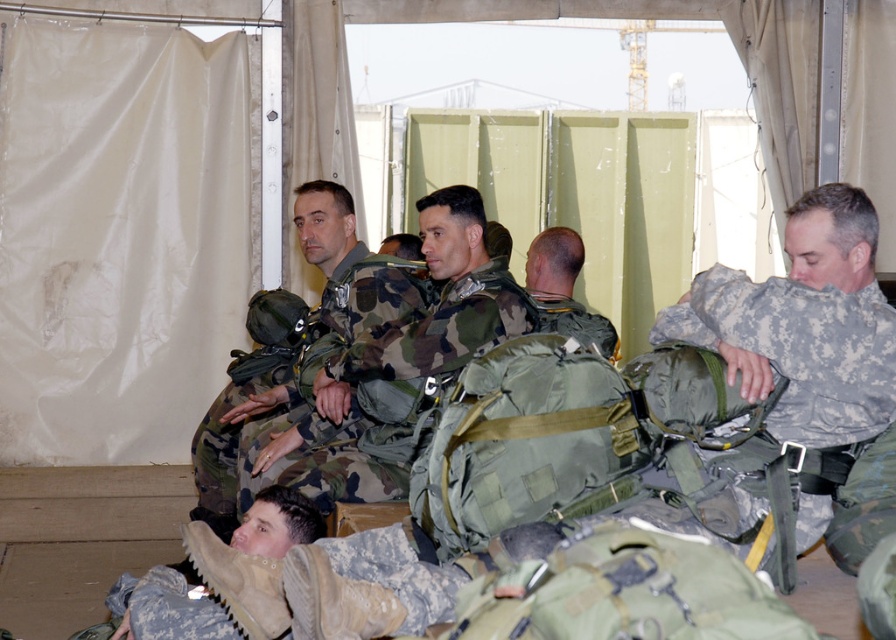
You are a photographer positioned outside the tent and want to capture a photo of both the camouflage fabric uniform at center and the green camouflage backpack at center. To ensure both are visible in the frame, should you adjust your camera to focus more to the left or the right?

The camouflage fabric uniform at center is to the left of the green camouflage backpack at center, so you should focus more to the left to include both in the frame.

Looking at this image, you are a photographer positioned outside the tent. You need to capture a photo that clearly shows both the camouflage uniform at center and the green camouflage backpack at center. Given their sizes, which object should you focus on first to ensure both are in frame?

The camouflage uniform at center is larger than the green camouflage backpack at center, so focusing on the camouflage uniform at center first will help ensure both objects are in frame as the backpack will naturally fit within the same view.